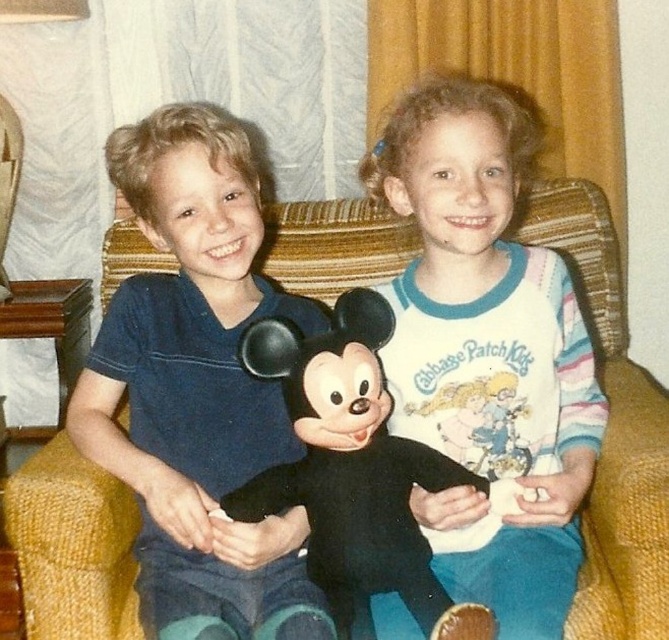
You are a photographer setting up for a family portrait. You need to ensure that the matte blue shirt at center and the yellow fabric couch at center are both visible in the frame. Based on their positions, which object should you focus on first to ensure both are in focus?

The matte blue shirt at center is in front of the yellow fabric couch at center, so you should focus on the matte blue shirt at center first to ensure both are in focus.

You are a photographer trying to capture a closeup of the white cotton shirt at upper center and the black plush toy at center. Which object is positioned to the right of the other?

The white cotton shirt at upper center is to the right of the black plush toy at center according to the description.